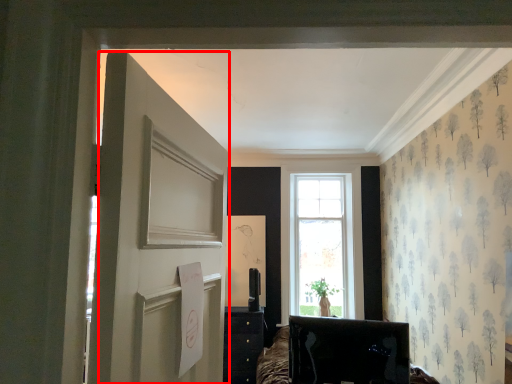
Question: From the image's perspective, where is door (annotated by the red box) located in relation to furniture in the image?

Choices:
 (A) below
 (B) above

Answer: (B)